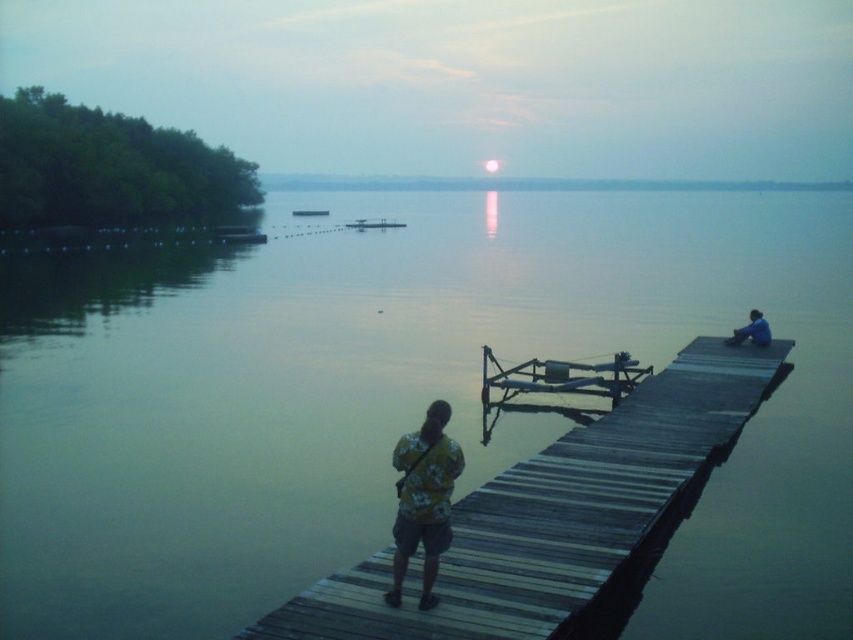
In the scene shown: Does smooth water at center come behind wooden dock at center?

Yes, it is.

The height and width of the screenshot is (640, 853). Describe the element at coordinates (402, 401) in the screenshot. I see `smooth water at center` at that location.

Image resolution: width=853 pixels, height=640 pixels. I want to click on smooth water at center, so click(402, 401).

Does smooth water at center come behind blue fabric shirt at right?

No, smooth water at center is closer to the viewer.

Can you confirm if smooth water at center is wider than blue fabric shirt at right?

Correct, the width of smooth water at center exceeds that of blue fabric shirt at right.

Is point (508, 419) closer to camera compared to point (764, 333)?

Yes, it is in front of point (764, 333).

The width and height of the screenshot is (853, 640). I want to click on smooth water at center, so click(402, 401).

In the scene shown: Does wooden dock at center appear under blue fabric shirt at right?

Yes, wooden dock at center is below blue fabric shirt at right.

Does point (589, 570) come closer to viewer compared to point (764, 339)?

Yes, point (589, 570) is closer to viewer.

Find the location of a particular element. wooden dock at center is located at coordinates [550, 515].

In order to click on wooden dock at center in this screenshot , I will do `click(550, 515)`.